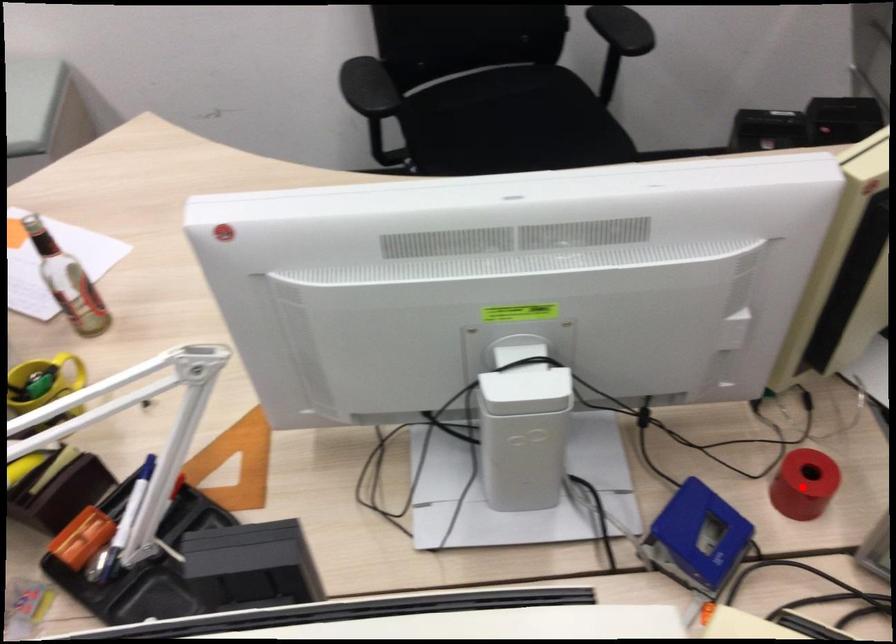
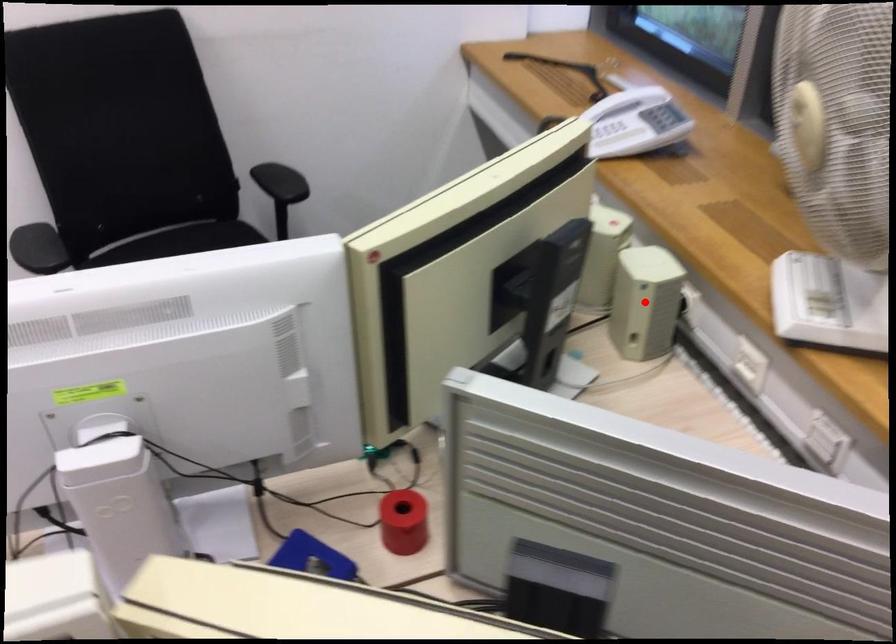
I am providing you with two images of the same scene from different viewpoints. A red point is marked on the first image and another point is marked on the second image. Do the highlighted points in image1 and image2 indicate the same real-world spot?

No